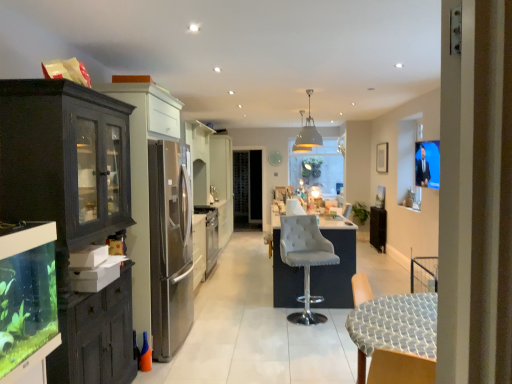
Question: Is clear glass aquarium at left to the left of wooden chair at lower right, which appears as the 1th chair when viewed from the front, from the viewer's perspective?

Choices:
 (A) no
 (B) yes

Answer: (B)

Question: Can you confirm if clear glass aquarium at left is thinner than wooden chair at lower right, which appears as the 1th chair when viewed from the front?

Choices:
 (A) yes
 (B) no

Answer: (A)

Question: Considering the relative sizes of clear glass aquarium at left and wooden chair at lower right, arranged as the second chair when viewed from the back, in the image provided, is clear glass aquarium at left taller than wooden chair at lower right, arranged as the second chair when viewed from the back,?

Choices:
 (A) no
 (B) yes

Answer: (A)

Question: Is wooden chair at lower right, arranged as the second chair when viewed from the back, located within clear glass aquarium at left?

Choices:
 (A) yes
 (B) no

Answer: (B)

Question: Are clear glass aquarium at left and wooden chair at lower right, arranged as the second chair when viewed from the back, beside each other?

Choices:
 (A) yes
 (B) no

Answer: (B)

Question: Does clear glass aquarium at left lie behind wooden chair at lower right, which appears as the 1th chair when viewed from the front?

Choices:
 (A) yes
 (B) no

Answer: (B)

Question: Considering the relative sizes of matte white pendant light at upper center, arranged as the first lamp when viewed from the front, and metallic gray pendant light at upper center, the second lamp positioned from the front, in the image provided, is matte white pendant light at upper center, arranged as the first lamp when viewed from the front, bigger than metallic gray pendant light at upper center, the second lamp positioned from the front,?

Choices:
 (A) no
 (B) yes

Answer: (B)

Question: Does matte white pendant light at upper center, arranged as the first lamp when viewed from the front, have a lesser width compared to metallic gray pendant light at upper center, the second lamp positioned from the front?

Choices:
 (A) yes
 (B) no

Answer: (A)

Question: Is matte white pendant light at upper center, arranged as the first lamp when viewed from the front, to the left of metallic gray pendant light at upper center, the second lamp positioned from the front, from the viewer's perspective?

Choices:
 (A) yes
 (B) no

Answer: (A)

Question: Does matte white pendant light at upper center, arranged as the first lamp when viewed from the front, turn towards metallic gray pendant light at upper center, the second lamp positioned from the front?

Choices:
 (A) yes
 (B) no

Answer: (B)

Question: From a real-world perspective, is matte white pendant light at upper center, which is the second lamp from back to front, over metallic gray pendant light at upper center, the second lamp positioned from the front?

Choices:
 (A) yes
 (B) no

Answer: (B)

Question: From the image's perspective, is matte white pendant light at upper center, arranged as the first lamp when viewed from the front, on metallic gray pendant light at upper center, positioned as the first lamp in back-to-front order?

Choices:
 (A) yes
 (B) no

Answer: (B)

Question: Is wooden chair at lower right, which appears as the 1th chair when viewed from the front, facing towards suede-like white bar stool at center, marked as the first chair in a back-to-front arrangement?

Choices:
 (A) yes
 (B) no

Answer: (B)